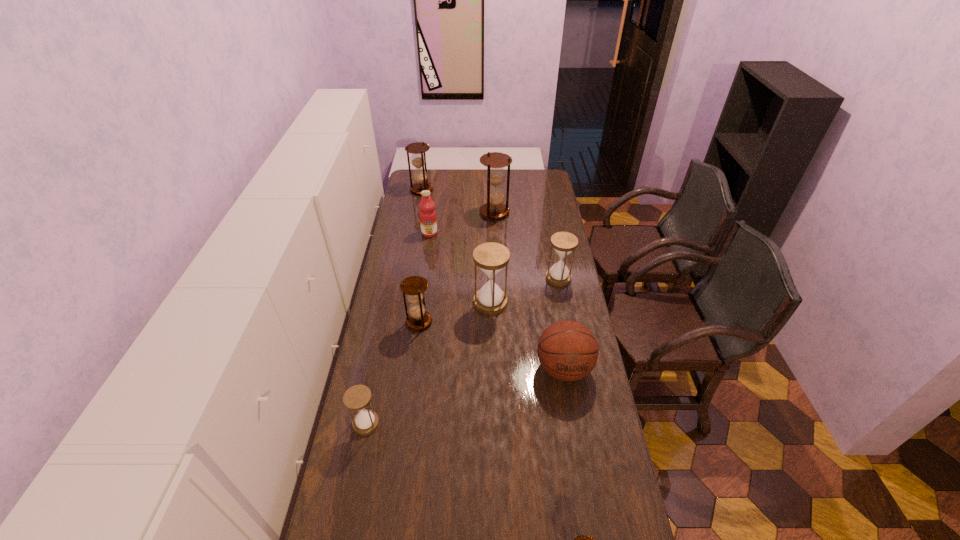
I want to click on the second biggest white hourglass, so click(x=564, y=243).

This screenshot has width=960, height=540. Find the location of `the seventh farthest object`. the seventh farthest object is located at coordinates (567, 350).

Locate an element on the screen. basketball is located at coordinates (567, 350).

The image size is (960, 540). Identify the location of the sixth farthest hourglass. (358, 397).

This screenshot has height=540, width=960. I want to click on the nearest white hourglass, so click(358, 397).

The width and height of the screenshot is (960, 540). What are the coordinates of `vacant space situated 0.320m on the back of the sixth nearest hourglass` in the screenshot? It's located at (492, 174).

Locate an element on the screen. The width and height of the screenshot is (960, 540). vacant space located 0.080m on the back of the farthest hourglass is located at coordinates (424, 177).

At what (x,y) coordinates should I click in order to perform the action: click on vacant space located on the left of the biggest white hourglass. Please return your answer as a coordinate pair (x, y). The width and height of the screenshot is (960, 540). Looking at the image, I should click on (418, 302).

Locate an element on the screen. Image resolution: width=960 pixels, height=540 pixels. free region located 0.200m on the label of the pink fruit juice is located at coordinates (425, 265).

At what (x,y) coordinates should I click in order to perform the action: click on free space located on the front of the third farthest brown hourglass. Please return your answer as a coordinate pair (x, y). The height and width of the screenshot is (540, 960). Looking at the image, I should click on (417, 342).